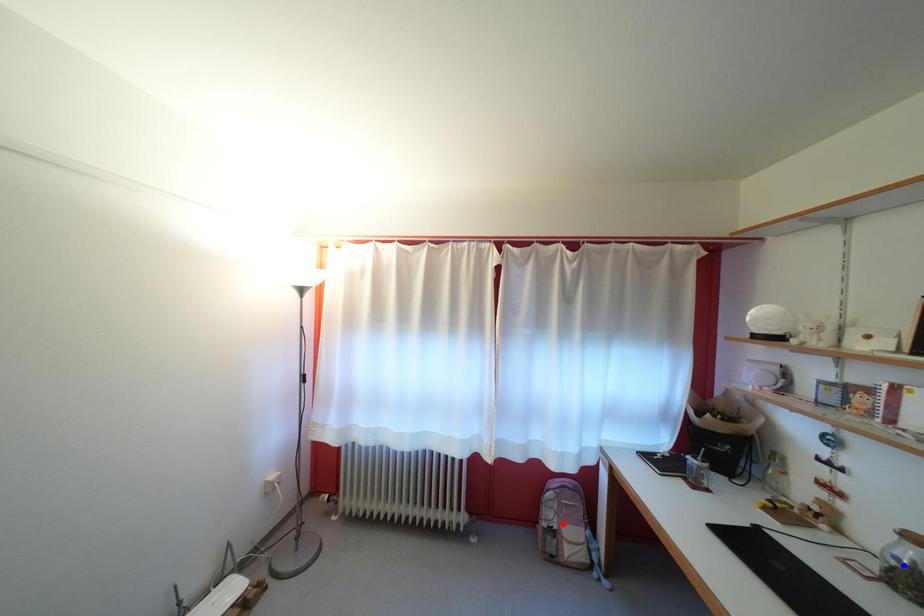
Question: Two points are marked on the image. Which point is closer to the camera?

Choices:
 (A) Blue point is closer.
 (B) Red point is closer.

Answer: (A)